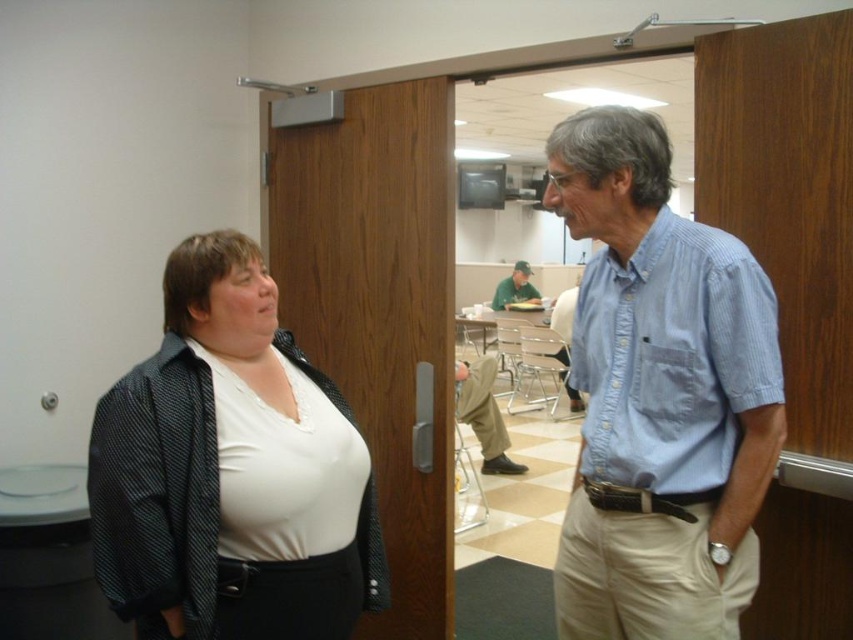
Locate an element on the screen. white matte shirt at center is located at coordinates (231, 470).

Does white matte shirt at center have a greater height compared to green fabric cap at center?

Indeed, white matte shirt at center has a greater height compared to green fabric cap at center.

Is point (288, 632) more distant than point (498, 307)?

No.

Locate an element on the screen. The width and height of the screenshot is (853, 640). white matte shirt at center is located at coordinates (231, 470).

Between white matte shirt at left and green fabric cap at center, which one has more height?

white matte shirt at left

Is white matte shirt at left positioned in front of green fabric cap at center?

Yes, white matte shirt at left is in front of green fabric cap at center.

Which is in front, point (693, 241) or point (500, 291)?

Positioned in front is point (693, 241).

Locate an element on the screen. white matte shirt at left is located at coordinates (660, 396).

Who is higher up, white matte shirt at left or white matte shirt at center?

Positioned higher is white matte shirt at left.

Which of these two, white matte shirt at left or white matte shirt at center, stands shorter?

white matte shirt at center

Between point (598, 355) and point (114, 570), which one is positioned behind?

Point (598, 355)

Identify the location of white matte shirt at left. Image resolution: width=853 pixels, height=640 pixels. (660, 396).